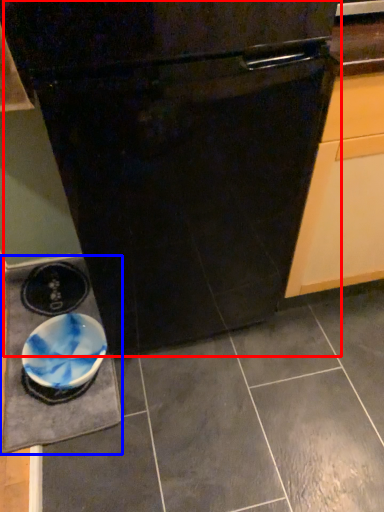
Question: Which object appears farthest to the camera in this image, oven (highlighted by a red box) or slate (highlighted by a blue box)?

Choices:
 (A) oven
 (B) slate

Answer: (B)